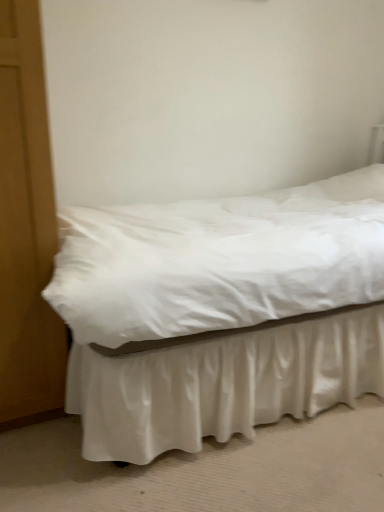
You are a GUI agent. You are given a task and a screenshot of the screen. Output one action in this format:
    pyautogui.click(x=<x>, y=<y>)
    Task: Click on the white satin bed at center
    
    Given the screenshot: What is the action you would take?
    pyautogui.click(x=220, y=312)

This screenshot has height=512, width=384. What do you see at coordinates (220, 312) in the screenshot? I see `white satin bed at center` at bounding box center [220, 312].

Measure the distance between point (x=95, y=387) and camera.

Point (x=95, y=387) and camera are 4.20 feet apart from each other.

Describe the element at coordinates (221, 382) in the screenshot. This screenshot has height=512, width=384. I see `satin white bed frame at lower center` at that location.

I want to click on satin white bed frame at lower center, so click(221, 382).

In order to click on white satin bed at center in this screenshot , I will do `click(220, 312)`.

Which object is positioned more to the right, satin white bed frame at lower center or white satin bed at center?

From the viewer's perspective, white satin bed at center appears more on the right side.

Is satin white bed frame at lower center closer to the viewer compared to white satin bed at center?

That is True.

Which is closer to the camera, (240, 426) or (109, 265)?

Point (240, 426) appears to be farther away from the viewer than point (109, 265).

From the image's perspective, is satin white bed frame at lower center positioned above or below white satin bed at center?

From the image's perspective, satin white bed frame at lower center appears below white satin bed at center.

From the picture: From a real-world perspective, does satin white bed frame at lower center sit lower than white satin bed at center?

Yes.

Does satin white bed frame at lower center have a greater width compared to white satin bed at center?

Indeed, satin white bed frame at lower center has a greater width compared to white satin bed at center.

Which of these two, satin white bed frame at lower center or white satin bed at center, stands taller?

white satin bed at center.

Between satin white bed frame at lower center and white satin bed at center, which one has smaller size?

satin white bed frame at lower center.

Is satin white bed frame at lower center not inside white satin bed at center?

Yes, satin white bed frame at lower center is outside of white satin bed at center.

Is satin white bed frame at lower center positioned far away from white satin bed at center?

No, satin white bed frame at lower center is not far away from white satin bed at center.

Is satin white bed frame at lower center facing towards white satin bed at center?

No, satin white bed frame at lower center is not facing towards white satin bed at center.

This screenshot has width=384, height=512. What are the coordinates of `bed above the satin white bed frame at lower center (from the image's perspective)` in the screenshot? It's located at (220, 312).

Which object is positioned more to the left, white satin bed at center or satin white bed frame at lower center?

satin white bed frame at lower center.

Is white satin bed at center positioned behind satin white bed frame at lower center?

Yes, white satin bed at center is further from the viewer.

Does point (165, 348) lie behind point (171, 347)?

No.

From the image's perspective, which one is positioned lower, white satin bed at center or satin white bed frame at lower center?

satin white bed frame at lower center is shown below in the image.

From a real-world perspective, is white satin bed at center positioned above or below satin white bed frame at lower center?

From a real-world perspective, white satin bed at center is physically above satin white bed frame at lower center.

Consider the image. Is white satin bed at center wider than satin white bed frame at lower center?

No, white satin bed at center is not wider than satin white bed frame at lower center.

Is white satin bed at center shorter than satin white bed frame at lower center?

No, white satin bed at center is not shorter than satin white bed frame at lower center.

Based on their sizes in the image, would you say white satin bed at center is bigger or smaller than satin white bed frame at lower center?

Clearly, white satin bed at center is larger in size than satin white bed frame at lower center.

Is satin white bed frame at lower center completely or partially inside white satin bed at center?

No, satin white bed frame at lower center is not inside white satin bed at center.

Are white satin bed at center and satin white bed frame at lower center far apart?

No, white satin bed at center is not far away from satin white bed frame at lower center.

Is white satin bed at center aimed at satin white bed frame at lower center?

No.

This screenshot has width=384, height=512. I want to click on bed frame that appears below the white satin bed at center (from the image's perspective), so click(x=221, y=382).

Where is `bed frame located underneath the white satin bed at center (from a real-world perspective)`? This screenshot has width=384, height=512. bed frame located underneath the white satin bed at center (from a real-world perspective) is located at coordinates (221, 382).

Where is `bed frame lying on the left of white satin bed at center`? bed frame lying on the left of white satin bed at center is located at coordinates (221, 382).